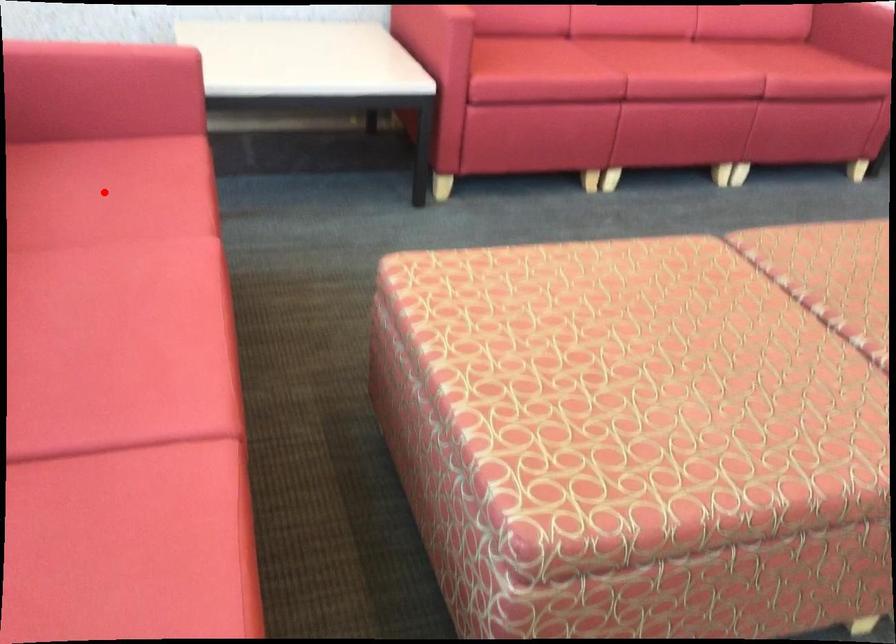
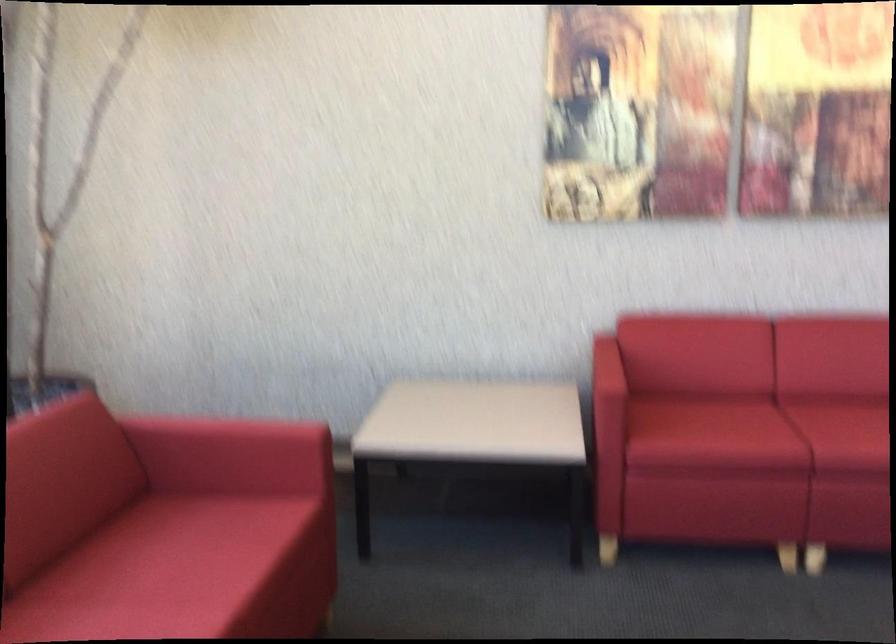
Where in the second image is the point corresponding to the highlighted location from the first image?

(195, 547)